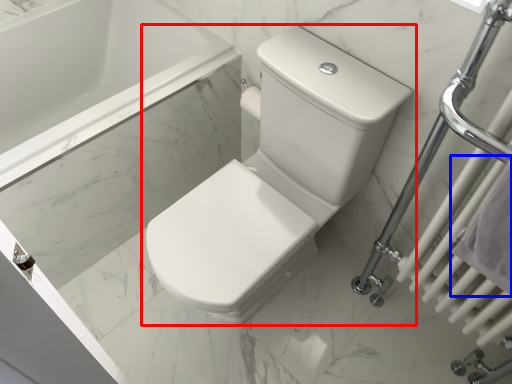
Question: Among these objects, which one is nearest to the camera, toilet (highlighted by a red box) or bath towel (highlighted by a blue box)?

Choices:
 (A) toilet
 (B) bath towel

Answer: (B)